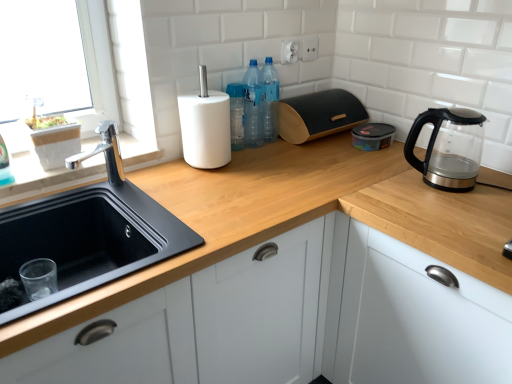
This screenshot has height=384, width=512. Identify the location of vacant space situated above wooden at upper center (from a real-world perspective). (228, 178).